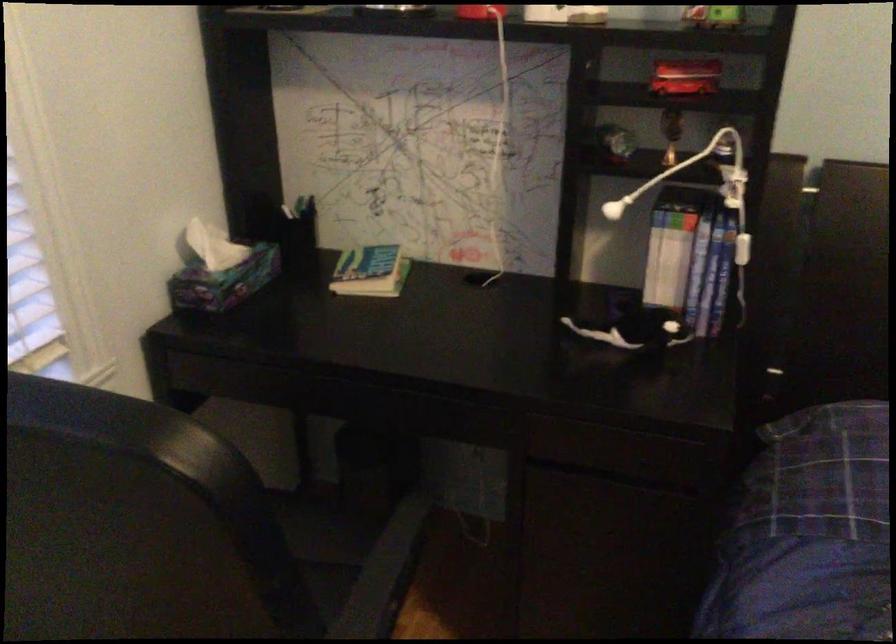
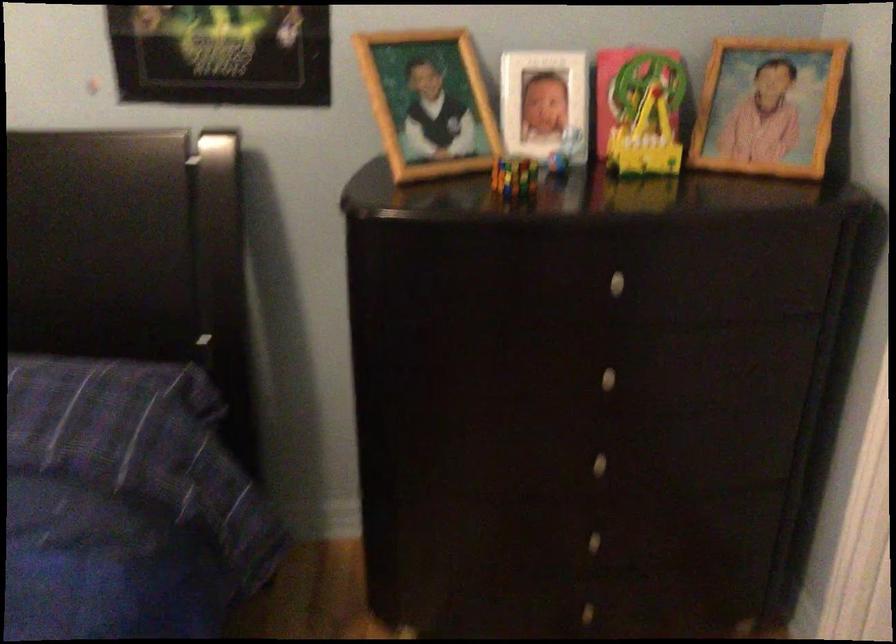
Question: In a continuous first-person perspective shot, in which direction is the camera moving?

Choices:
 (A) Left
 (B) Right
 (C) Forward
 (D) Backward

Answer: (B)